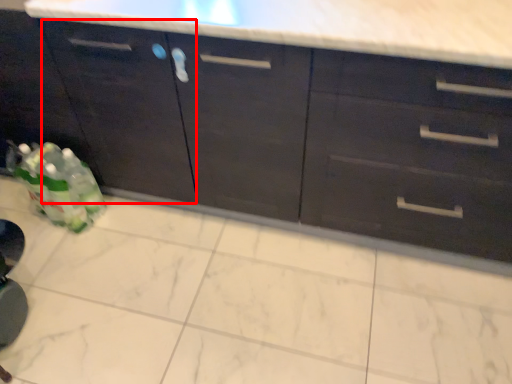
Question: From the image's perspective, what is the correct spatial positioning of cabinetry (annotated by the red box) in reference to cabinetry?

Choices:
 (A) below
 (B) above

Answer: (B)